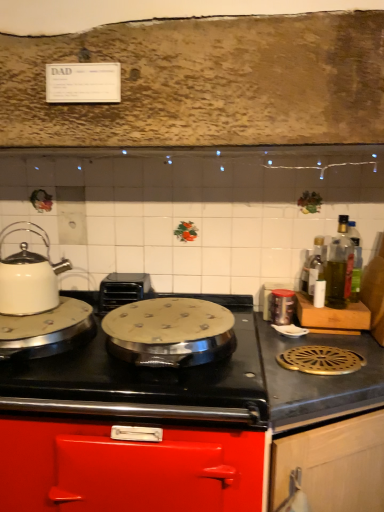
This screenshot has width=384, height=512. What are the coordinates of `blank space above metallic gray stovetop at right (from a real-world perspective)` in the screenshot? It's located at (331, 353).